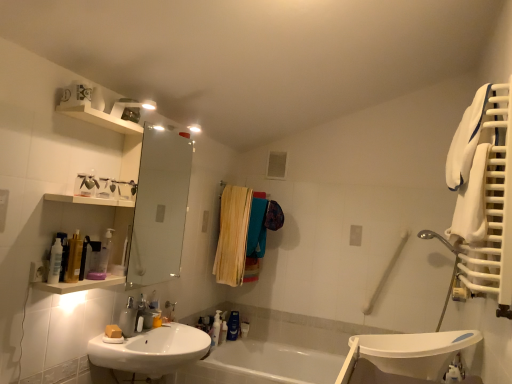
What is the approximate width of translucent plastic pump bottle at lower center, the third toiletry in the right-to-left sequence?

translucent plastic pump bottle at lower center, the third toiletry in the right-to-left sequence, is 2.37 inches wide.

Describe the element at coordinates (145, 313) in the screenshot. I see `metallic silver faucet at sink left` at that location.

Find the location of a particular element. The width and height of the screenshot is (512, 384). white glossy sink at lower left is located at coordinates (152, 350).

Find the location of a particular element. translucent plastic pump bottle at lower center, the first toiletry viewed from the left is located at coordinates (216, 328).

Is blue glossy bottle at lower center, placed as the 1th toiletry when sorted from right to left, not close to translucent plastic bottle at lower center, the second toiletry when ordered from right to left?

No, blue glossy bottle at lower center, placed as the 1th toiletry when sorted from right to left, is in close proximity to translucent plastic bottle at lower center, the second toiletry when ordered from right to left.

Does blue glossy bottle at lower center, positioned as the 3th toiletry in left-to-right order, have a greater height compared to translucent plastic bottle at lower center, acting as the second toiletry starting from the left?

Indeed, blue glossy bottle at lower center, positioned as the 3th toiletry in left-to-right order, has a greater height compared to translucent plastic bottle at lower center, acting as the second toiletry starting from the left.

Identify the location of toiletry that is the 2nd object located in front of the blue glossy bottle at lower center, positioned as the 3th toiletry in left-to-right order. Image resolution: width=512 pixels, height=384 pixels. (223, 332).

Which is more to the right, blue glossy bottle at lower center, placed as the 1th toiletry when sorted from right to left, or translucent plastic bottle at lower center, acting as the second toiletry starting from the left?

blue glossy bottle at lower center, placed as the 1th toiletry when sorted from right to left, is more to the right.

Considering the points (128, 329) and (143, 307), which point is in front, point (128, 329) or point (143, 307)?

The point (128, 329) is more forward.

Consider the image. Can you confirm if matte silver soap dispenser at lower left is taller than metallic silver faucet at sink left?

Yes.

From the image's perspective, between matte silver soap dispenser at lower left and metallic silver faucet at sink left, who is located below?

metallic silver faucet at sink left.

Is metallic silver faucet at sink left located within matte silver soap dispenser at lower left?

No, metallic silver faucet at sink left is located outside of matte silver soap dispenser at lower left.

From the image's perspective, which is above, translucent plastic bottle at lower center, the second toiletry when ordered from right to left, or metallic silver faucet at sink left?

metallic silver faucet at sink left, from the image's perspective.

Does translucent plastic bottle at lower center, acting as the second toiletry starting from the left, appear on the left side of metallic silver faucet at sink left?

In fact, translucent plastic bottle at lower center, acting as the second toiletry starting from the left, is to the right of metallic silver faucet at sink left.

In order to click on plumbing fixture to the left of translucent plastic bottle at lower center, acting as the second toiletry starting from the left in this screenshot , I will do `click(145, 313)`.

In terms of width, does translucent plastic bottle at lower center, the second toiletry when ordered from right to left, look wider or thinner when compared to metallic silver faucet at sink left?

Considering their sizes, translucent plastic bottle at lower center, the second toiletry when ordered from right to left, looks slimmer than metallic silver faucet at sink left.

In terms of size, does white glossy sink at lower left appear bigger or smaller than white glossy bathtub at center?

Considering their sizes, white glossy sink at lower left takes up less space than white glossy bathtub at center.

Is white glossy sink at lower left not inside white glossy bathtub at center?

Yes, white glossy sink at lower left is outside of white glossy bathtub at center.

Identify the location of sink above the white glossy bathtub at center (from a real-world perspective). (152, 350).

From a real-world perspective, which is physically below, white glossy sink at lower left or white glossy bathtub at center?

white glossy bathtub at center.

Is matte yellow soap at sink left aimed at white glossy sink at lower left?

No, matte yellow soap at sink left is not turned towards white glossy sink at lower left.

From the picture: From a real-world perspective, does matte yellow soap at sink left stand above white glossy sink at lower left?

Yes.

Is matte yellow soap at sink left shorter than white glossy sink at lower left?

Correct, matte yellow soap at sink left is not as tall as white glossy sink at lower left.

What's the angular difference between matte yellow soap at sink left and white glossy sink at lower left's facing directions?

The facing directions of matte yellow soap at sink left and white glossy sink at lower left are 61.8 degrees apart.

Is metallic silver faucet at sink left shorter than matte yellow soap at sink left?

No.

Is the surface of metallic silver faucet at sink left in direct contact with matte yellow soap at sink left?

No, metallic silver faucet at sink left is not beside matte yellow soap at sink left.

Locate an element on the screen. soap in front of the metallic silver faucet at sink left is located at coordinates (113, 331).

Is metallic silver faucet at sink left to the left of matte yellow soap at sink left from the viewer's perspective?

Incorrect, metallic silver faucet at sink left is not on the left side of matte yellow soap at sink left.

Looking at their sizes, would you say translucent plastic pump bottle at lower center, the third toiletry in the right-to-left sequence, is wider or thinner than matte yellow soap at sink left?

translucent plastic pump bottle at lower center, the third toiletry in the right-to-left sequence, is thinner than matte yellow soap at sink left.

From a real-world perspective, which is physically below, translucent plastic pump bottle at lower center, the third toiletry in the right-to-left sequence, or matte yellow soap at sink left?

translucent plastic pump bottle at lower center, the third toiletry in the right-to-left sequence, from a real-world perspective.

Can we say translucent plastic pump bottle at lower center, the first toiletry viewed from the left, lies outside matte yellow soap at sink left?

Indeed, translucent plastic pump bottle at lower center, the first toiletry viewed from the left, is completely outside matte yellow soap at sink left.

Is the depth of translucent plastic pump bottle at lower center, the first toiletry viewed from the left, greater than that of matte yellow soap at sink left?

Yes, translucent plastic pump bottle at lower center, the first toiletry viewed from the left, is further from the camera.

From the image's perspective, starting from the translucent plastic bottle at lower center, acting as the second toiletry starting from the left, which toiletry is the 1st one above? Please provide its 2D coordinates.

[(233, 326)]

Identify the location of plumbing fixture that is behind the matte silver soap dispenser at lower left. Image resolution: width=512 pixels, height=384 pixels. (145, 313).

Based on their spatial positions, is white soft towel at right or matte silver soap dispenser at lower left further from matte yellow soap at sink left?

Based on the image, white soft towel at right appears to be further to matte yellow soap at sink left.

When comparing their distances from matte yellow soap at sink left, does white glossy bathtub at center or white soft towel at right seem further?

white soft towel at right.

Based on their spatial positions, is white glossy sink at lower left or white glossy bathtub at center further from translucent plastic bottle at lower center, acting as the second toiletry starting from the left?

white glossy sink at lower left is further to translucent plastic bottle at lower center, acting as the second toiletry starting from the left.

In the scene shown: Which object lies nearer to the anchor point translucent plastic bottle at lower center, the second toiletry when ordered from right to left, white glossy bathtub at center or wooden laundry at center?

white glossy bathtub at center.

Which object lies further to the anchor point translucent plastic pump bottle at lower center, the first toiletry viewed from the left, wooden laundry at center or matte silver soap dispenser at lower left?

The object further to translucent plastic pump bottle at lower center, the first toiletry viewed from the left, is matte silver soap dispenser at lower left.

Looking at the image, which one is located closer to translucent plastic bottle at lower center, the second toiletry when ordered from right to left, white glossy sink at lower left or translucent plastic pump bottle at lower center, the third toiletry in the right-to-left sequence?

The object closer to translucent plastic bottle at lower center, the second toiletry when ordered from right to left, is translucent plastic pump bottle at lower center, the third toiletry in the right-to-left sequence.

From the picture: Estimate the real-world distances between objects in this image. Which object is further from matte silver soap dispenser at lower left, translucent plastic bottle at lower center, acting as the second toiletry starting from the left, or translucent plastic pump bottle at lower center, the third toiletry in the right-to-left sequence?

translucent plastic bottle at lower center, acting as the second toiletry starting from the left, is positioned further to the anchor matte silver soap dispenser at lower left.

Considering their positions, is white soft towel at right positioned closer to white glossy bathtub at center than white glossy sink at lower left?

Based on the image, white glossy sink at lower left appears to be nearer to white glossy bathtub at center.

Locate an element on the screen. laundry between matte yellow soap at sink left and blue glossy bottle at lower center, positioned as the 3th toiletry in left-to-right order, in the front-back direction is located at coordinates (243, 234).

Find the location of a particular element. This screenshot has width=512, height=384. bath located between matte yellow soap at sink left and translucent plastic pump bottle at lower center, the first toiletry viewed from the left, in the depth direction is located at coordinates (267, 364).

The width and height of the screenshot is (512, 384). Find the location of `laundry between matte yellow soap at sink left and translucent plastic bottle at lower center, the second toiletry when ordered from right to left, from front to back`. laundry between matte yellow soap at sink left and translucent plastic bottle at lower center, the second toiletry when ordered from right to left, from front to back is located at coordinates (243, 234).

At what (x,y) coordinates should I click in order to perform the action: click on plumbing fixture between white soft towel at right and wooden laundry at center from front to back. Please return your answer as a coordinate pair (x, y). Looking at the image, I should click on (145, 313).